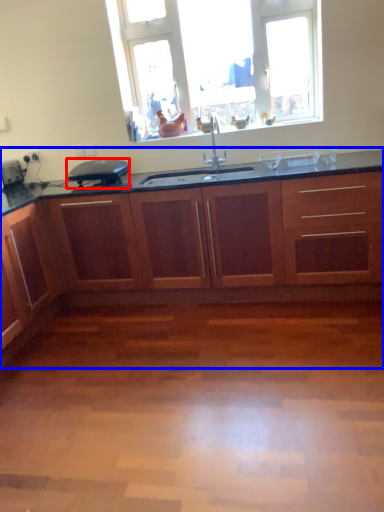
Question: Which point is further to the camera, appliance (highlighted by a red box) or cabinetry (highlighted by a blue box)?

Choices:
 (A) appliance
 (B) cabinetry

Answer: (A)